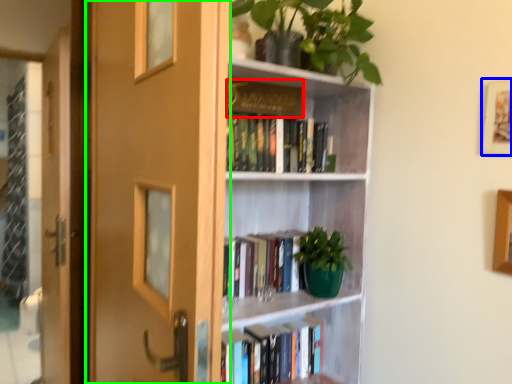
Question: Which is farther away from book (highlighted by a red box)? picture frame (highlighted by a blue box) or door (highlighted by a green box)?

Choices:
 (A) picture frame
 (B) door

Answer: (A)